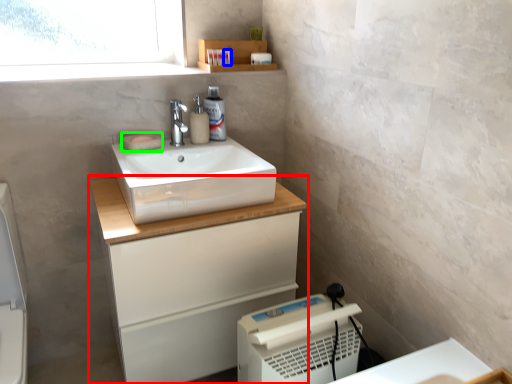
Question: Which object is the closest to the bathroom cabinet (highlighted by a red box)? Choose among these: toiletry (highlighted by a blue box) or soap (highlighted by a green box).

Choices:
 (A) toiletry
 (B) soap

Answer: (B)